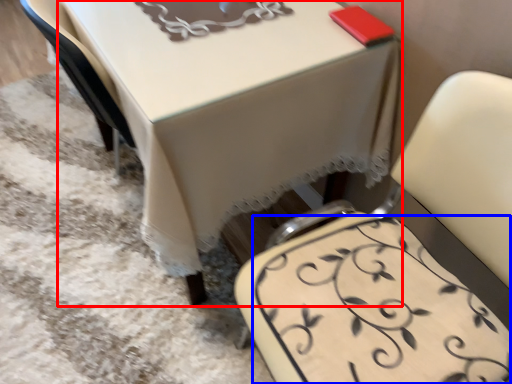
Question: Among these objects, which one is farthest to the camera, table (highlighted by a red box) or design (highlighted by a blue box)?

Choices:
 (A) table
 (B) design

Answer: (A)